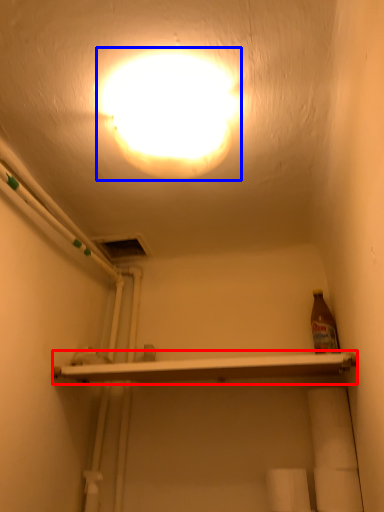
Question: Which of the following is the farthest to the observer, shelf (highlighted by a red box) or lamp (highlighted by a blue box)?

Choices:
 (A) shelf
 (B) lamp

Answer: (A)